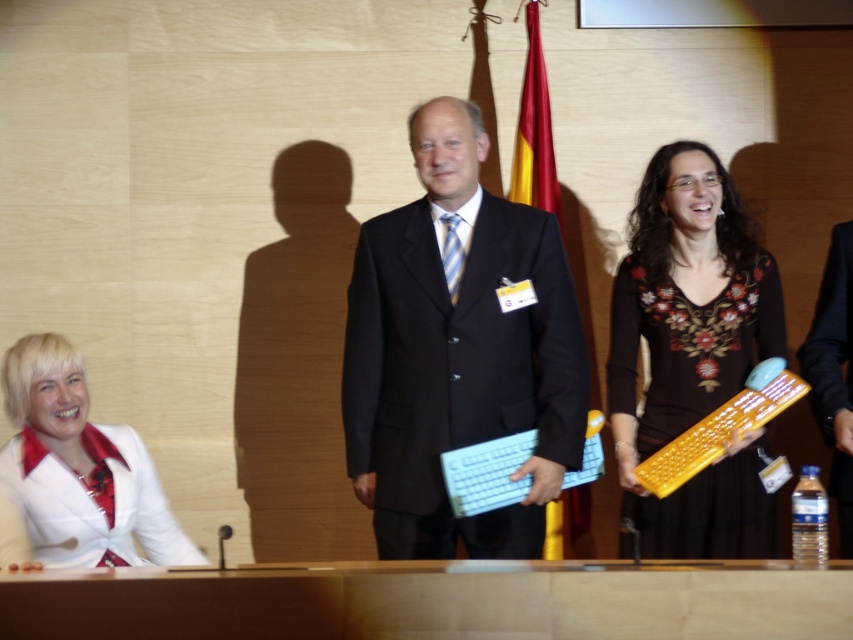
Can you confirm if white satin blouse at lower left is positioned to the left of red fabric flag at center?

Indeed, white satin blouse at lower left is positioned on the left side of red fabric flag at center.

You are a GUI agent. You are given a task and a screenshot of the screen. Output one action in this format:
    pyautogui.click(x=<x>, y=<y>)
    Task: Click on the white satin blouse at lower left
    The image size is (853, 640).
    Given the screenshot: What is the action you would take?
    pyautogui.click(x=74, y=472)

Which is behind, point (48, 392) or point (555, 192)?

Positioned behind is point (555, 192).

This screenshot has width=853, height=640. I want to click on white satin blouse at lower left, so click(74, 472).

Is red fabric flag at center further to the viewer compared to blue striped tie at center?

Yes, it is.

Does red fabric flag at center have a greater height compared to blue striped tie at center?

Indeed, red fabric flag at center has a greater height compared to blue striped tie at center.

Is point (532, 150) more distant than point (450, 221)?

Yes, it is behind point (450, 221).

I want to click on red fabric flag at center, so click(x=534, y=129).

Is brown floral dress at right wider than red fabric flag at center?

Yes.

Between brown floral dress at right and red fabric flag at center, which one has more height?

With more height is brown floral dress at right.

Describe the element at coordinates (692, 353) in the screenshot. I see `brown floral dress at right` at that location.

Identify the location of brown floral dress at right. Image resolution: width=853 pixels, height=640 pixels. (692, 353).